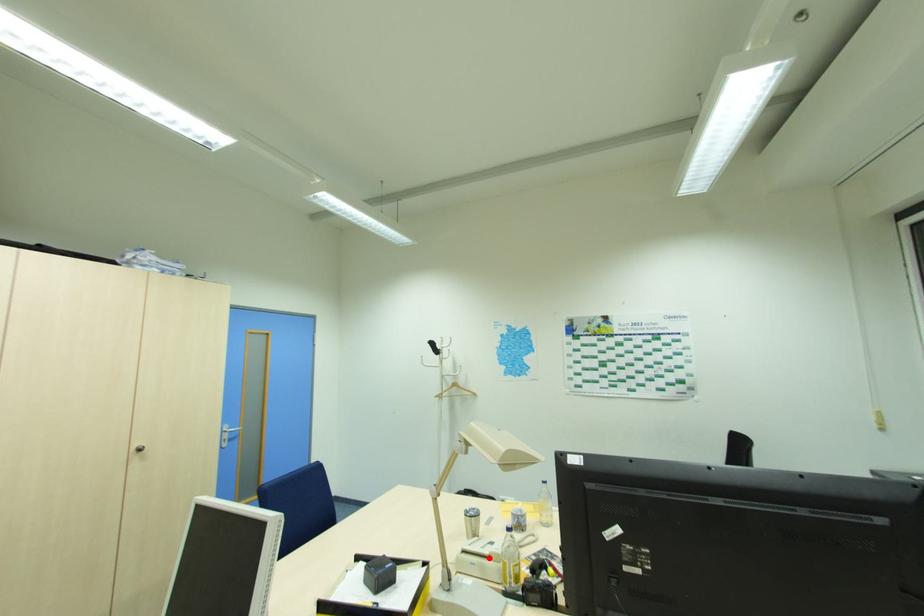
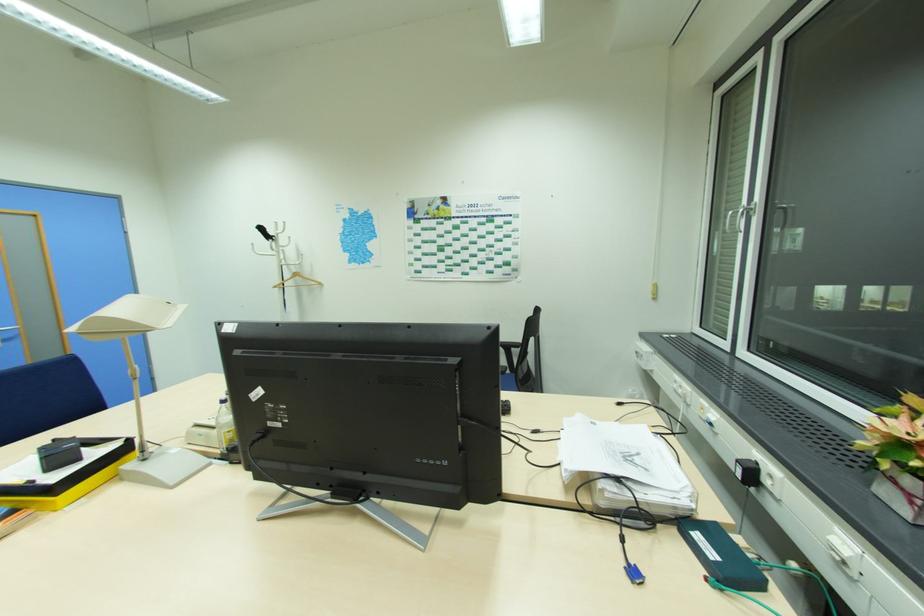
Where in the second image is the point corresponding to the highlighted location from the first image?

(216, 428)